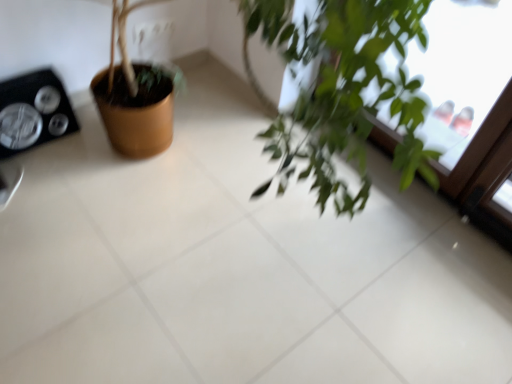
Locate an element on the screen. Image resolution: width=512 pixels, height=384 pixels. unoccupied region to the right of metallic silver speaker at upper left is located at coordinates (82, 149).